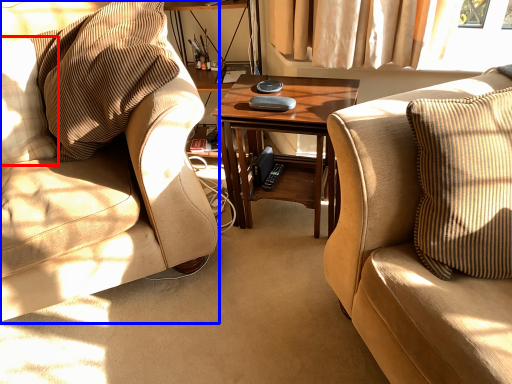
Question: Which of the following is the closest to the observer, pillow (highlighted by a red box) or chair (highlighted by a blue box)?

Choices:
 (A) pillow
 (B) chair

Answer: (B)